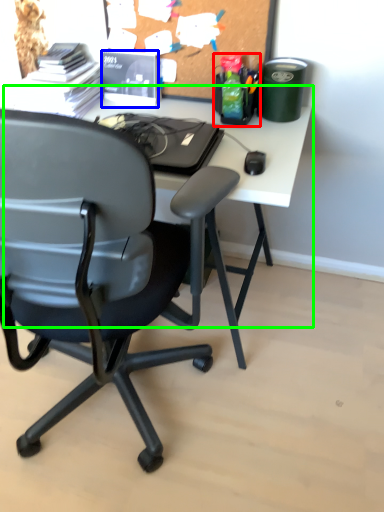
Question: Based on their relative distances, which object is nearer to stationery (highlighted by a red box)? Choose from stationery (highlighted by a blue box) and computer desk (highlighted by a green box).

Choices:
 (A) stationery
 (B) computer desk

Answer: (B)